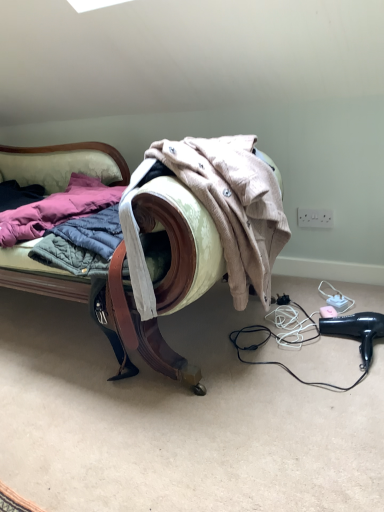
Find the location of a particular element. Image resolution: width=384 pixels, height=512 pixels. free space that is in between wooden armchair at center and black plastic hair dryer at lower right is located at coordinates (299, 347).